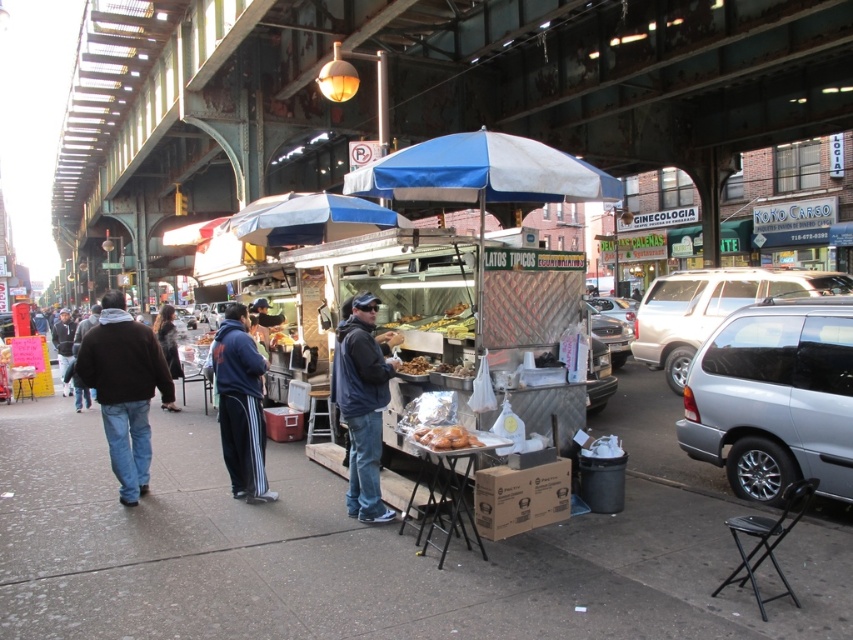
Between brown cotton jacket at left and blue fleece jacket at center, which one has less height?

blue fleece jacket at center

Who is taller, brown cotton jacket at left or blue fleece jacket at center?

brown cotton jacket at left is taller.

In order to click on brown cotton jacket at left in this screenshot , I will do `click(125, 388)`.

Which is above, dark blue jacket at center or golden crispy chicken at center?

dark blue jacket at center

How far apart are dark blue jacket at center and golden crispy chicken at center?

36.03 inches

Is point (370, 298) less distant than point (436, 449)?

No.

Locate an element on the screen. dark blue jacket at center is located at coordinates (x=363, y=404).

Describe the element at coordinates (775, 397) in the screenshot. I see `silver metallic minivan at right` at that location.

Between point (817, 474) and point (173, 410), which one is positioned in front?

Point (817, 474)

Is point (791, 394) farther from viewer compared to point (167, 410)?

That is False.

Where is `silver metallic minivan at right`? silver metallic minivan at right is located at coordinates (775, 397).